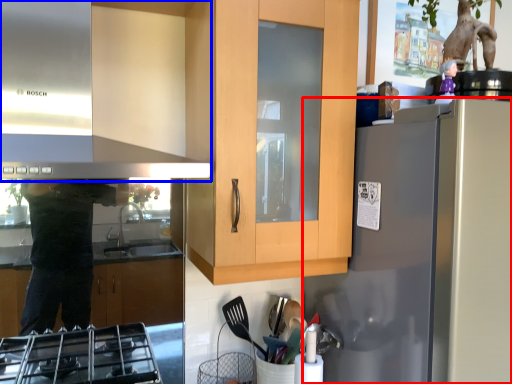
Question: Which object is further to the camera taking this photo, refrigerator (highlighted by a red box) or exhaust hood (highlighted by a blue box)?

Choices:
 (A) refrigerator
 (B) exhaust hood

Answer: (A)